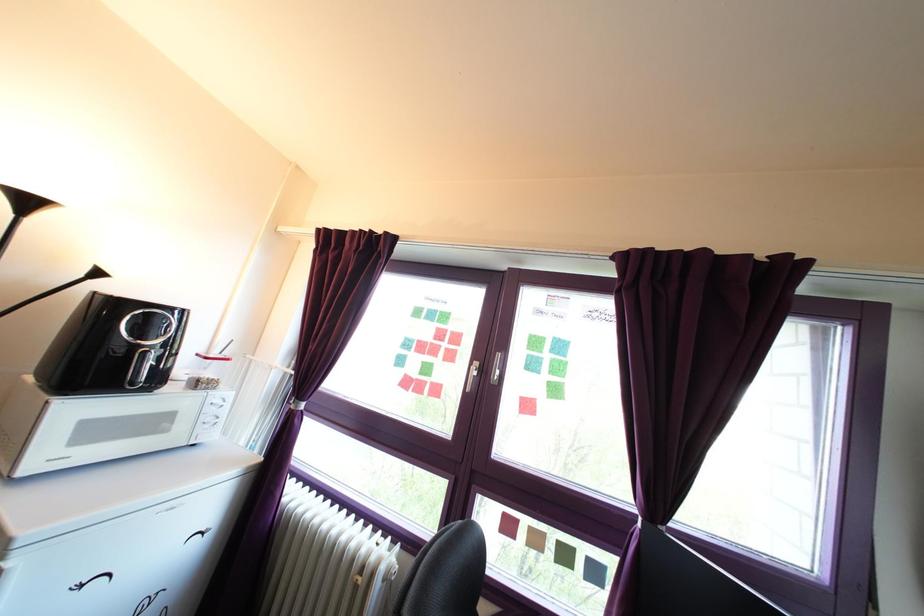
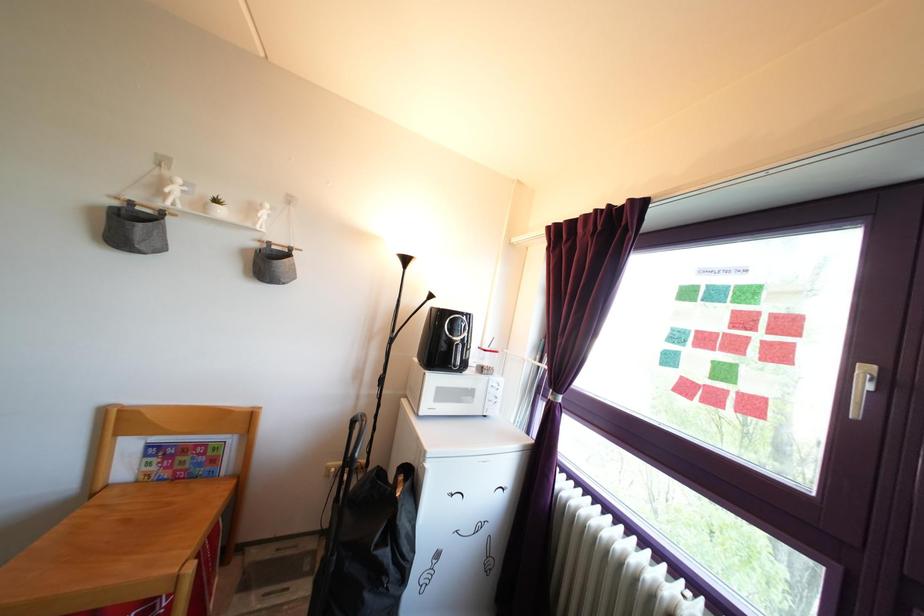
Question: Based on the continuous images, in which direction is the camera rotating? Reply with the corresponding letter.

Choices:
 (A) Left
 (B) Right
 (C) Up
 (D) Down

Answer: (A)